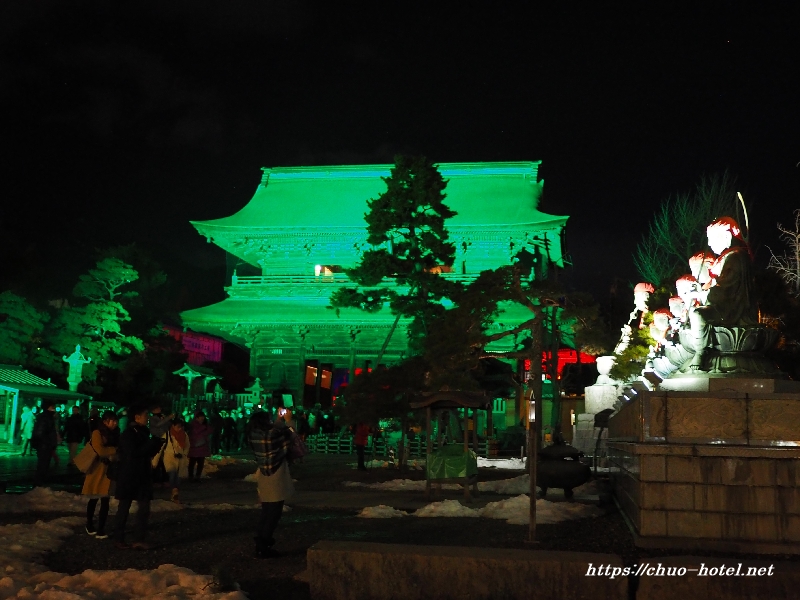
Where is `windows`? windows is located at coordinates (328, 272).